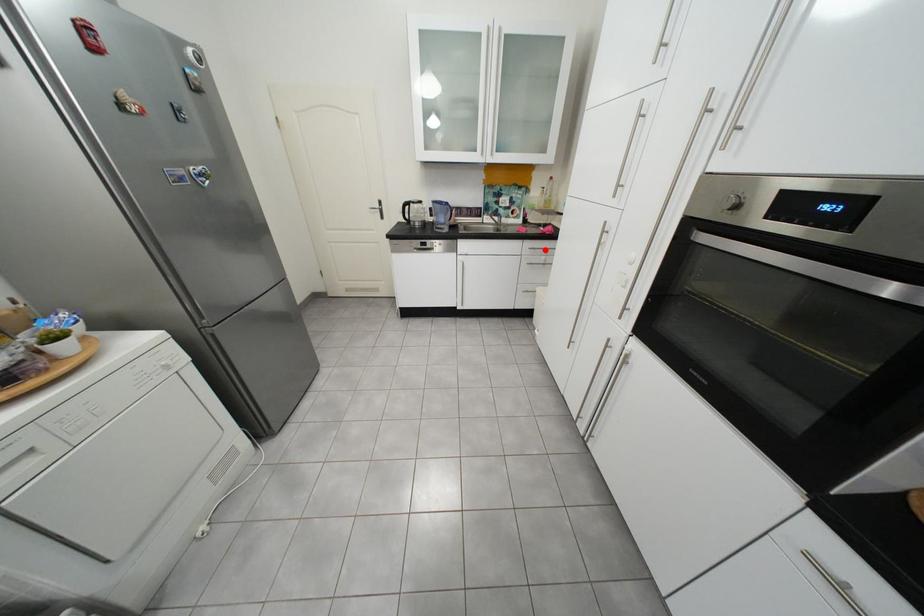
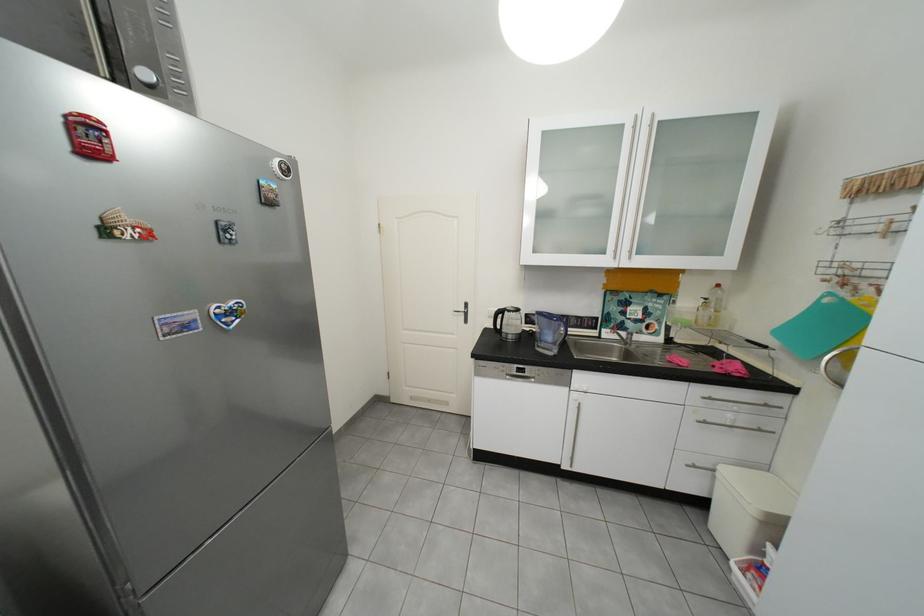
Question: I am providing you with two images of the same scene from different viewpoints. Image1 has a red point marked. In image2, the corresponding 3D location appears at what relative position? Reply with the corresponding letter.

Choices:
 (A) Closer
 (B) Farther

Answer: (B)